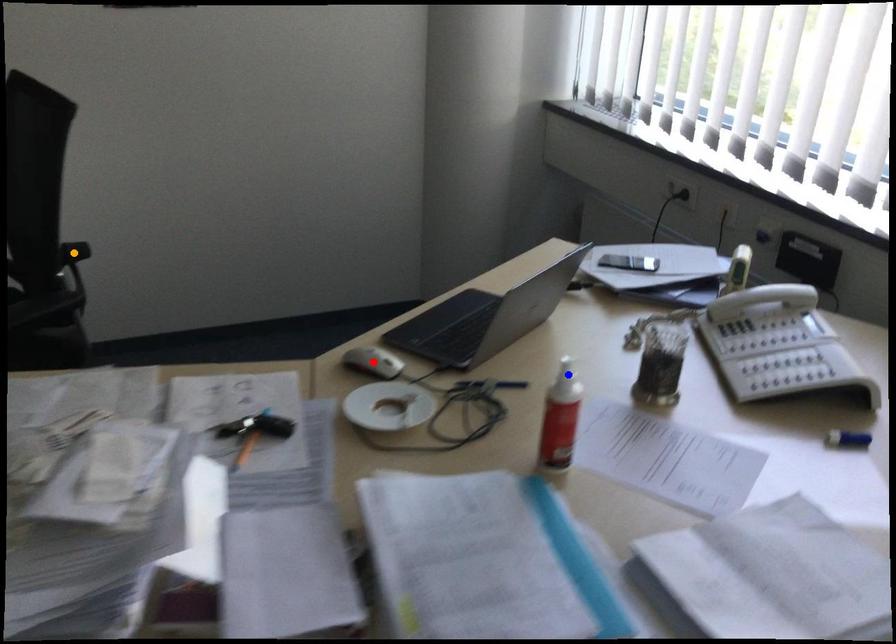
Order these from nearest to farthest:
- orange point
- red point
- blue point

blue point
red point
orange point